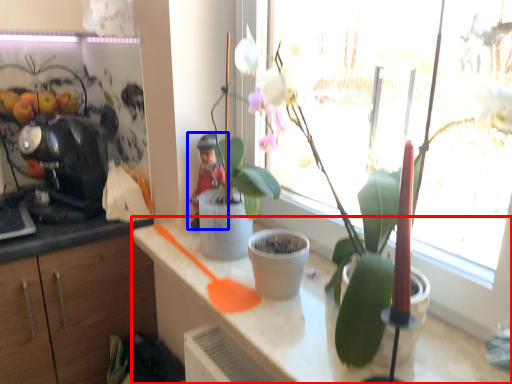
Question: Among these objects, which one is nearest to the camera, countertop (highlighted by a red box) or person (highlighted by a blue box)?

Choices:
 (A) countertop
 (B) person

Answer: (A)